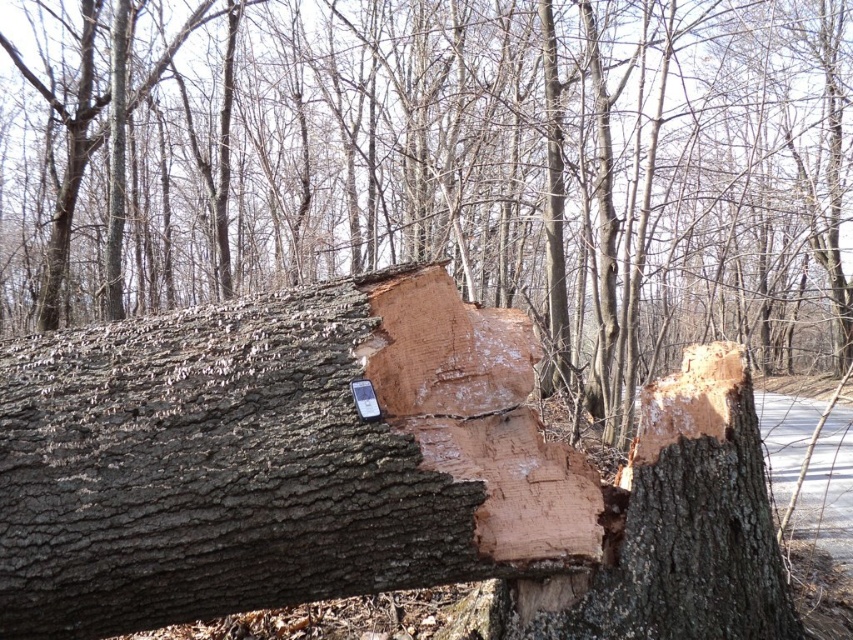
Question: Which object is farther from the camera taking this photo?

Choices:
 (A) smooth brown log at center
 (B) light brown wood at center

Answer: (A)

Question: Does smooth brown log at center lie behind light brown wood at center?

Choices:
 (A) yes
 (B) no

Answer: (A)

Question: Which of the following is the closest to the observer?

Choices:
 (A) (152, 276)
 (B) (786, 600)

Answer: (B)

Question: Is smooth brown log at center closer to the viewer compared to light brown wood at center?

Choices:
 (A) yes
 (B) no

Answer: (B)

Question: Is smooth brown log at center positioned before light brown wood at center?

Choices:
 (A) no
 (B) yes

Answer: (A)

Question: Which point is closer to the camera taking this photo?

Choices:
 (A) (844, 106)
 (B) (630, 513)

Answer: (B)